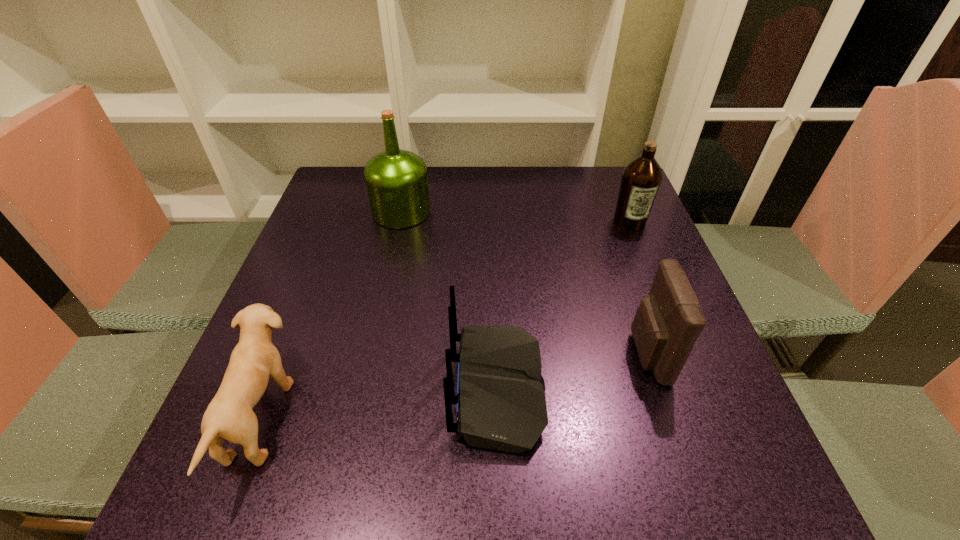
Where is `olive oil present at the right edge`? olive oil present at the right edge is located at coordinates (641, 178).

At what (x,y) coordinates should I click in order to perform the action: click on pouch at the right edge. Please return your answer as a coordinate pair (x, y). The width and height of the screenshot is (960, 540). Looking at the image, I should click on (669, 320).

Where is `object situated at the far left corner`? The height and width of the screenshot is (540, 960). object situated at the far left corner is located at coordinates (396, 180).

You are a GUI agent. You are given a task and a screenshot of the screen. Output one action in this format:
    pyautogui.click(x=<x>, y=<y>)
    Task: Click on the object at the near left corner
    The width and height of the screenshot is (960, 540).
    Given the screenshot: What is the action you would take?
    pyautogui.click(x=229, y=415)

Locate an element on the screen. The height and width of the screenshot is (540, 960). object present at the far right corner is located at coordinates (641, 178).

Image resolution: width=960 pixels, height=540 pixels. I want to click on free region at the far edge, so click(x=482, y=172).

In the image, there is a desktop. At what (x,y) coordinates should I click in order to perform the action: click on free space at the near edge. Please return your answer as a coordinate pair (x, y). The height and width of the screenshot is (540, 960). Looking at the image, I should click on (561, 484).

The height and width of the screenshot is (540, 960). What are the coordinates of `free location at the left edge` in the screenshot? It's located at (312, 227).

The height and width of the screenshot is (540, 960). What are the coordinates of `vacant space at the far left corner` in the screenshot? It's located at (337, 175).

You are a GUI agent. You are given a task and a screenshot of the screen. Output one action in this format:
    pyautogui.click(x=<x>, y=<y>)
    Task: Click on the vacant area at the far right corner
    Image resolution: width=960 pixels, height=540 pixels.
    Given the screenshot: What is the action you would take?
    pyautogui.click(x=612, y=214)